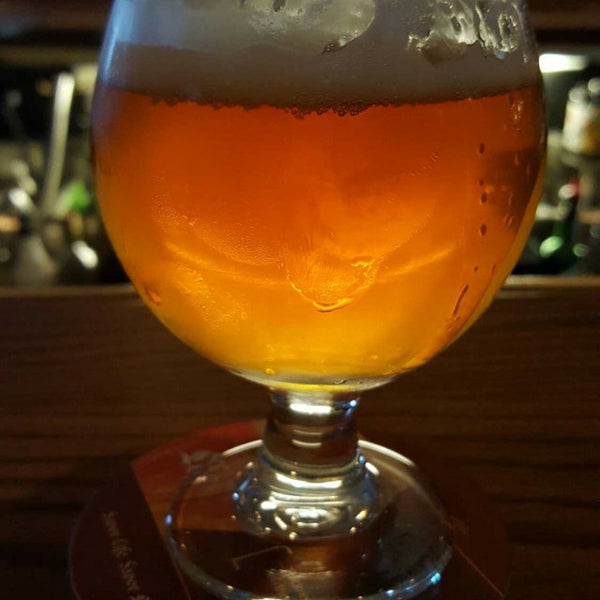
Locate an element on the screen. red portion of coaster is located at coordinates (168, 454).